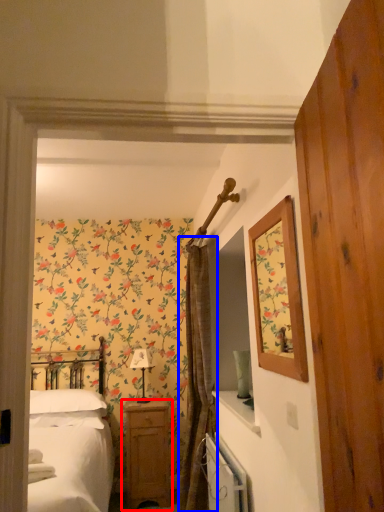
Question: Which object appears farthest to the camera in this image, nightstand (highlighted by a red box) or curtain (highlighted by a blue box)?

Choices:
 (A) nightstand
 (B) curtain

Answer: (A)